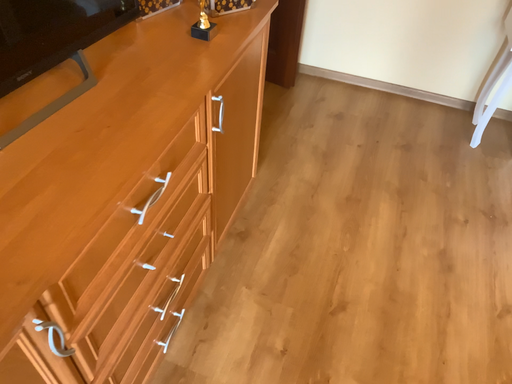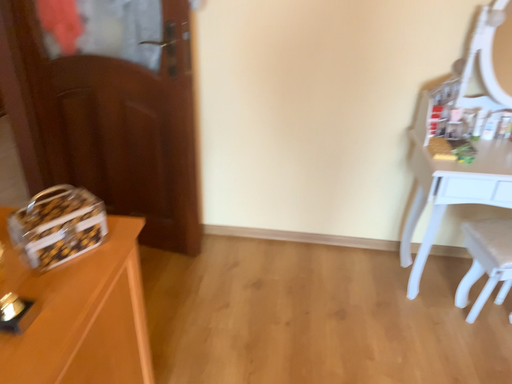
Question: How did the camera likely rotate when shooting the video?

Choices:
 (A) rotated downward
 (B) rotated upward

Answer: (B)